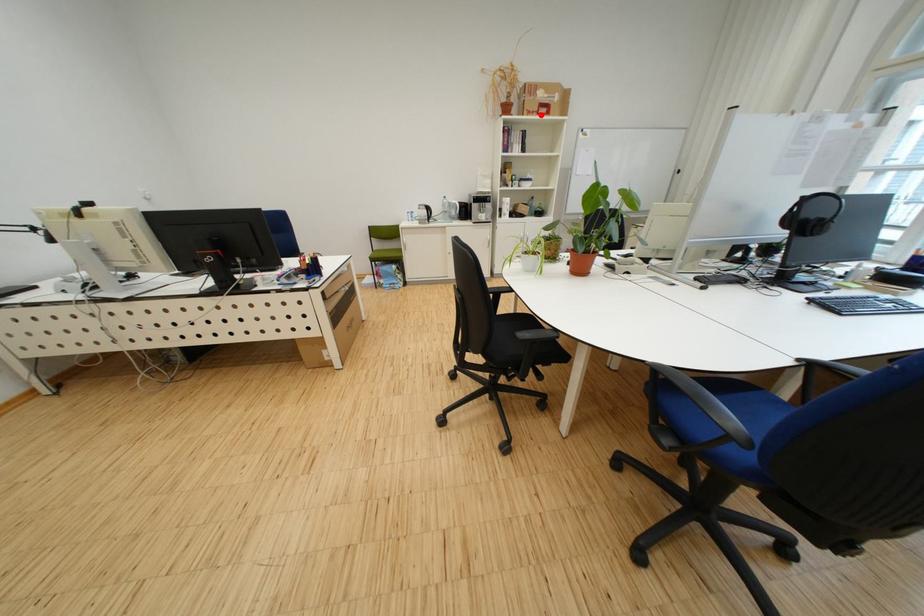
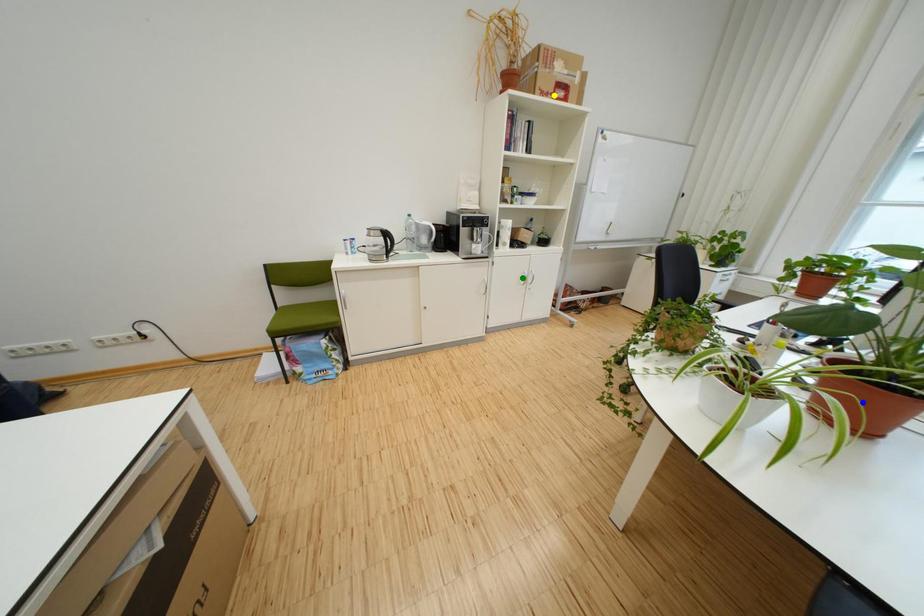
Question: I am providing you with two images of the same scene from different viewpoints. A red point is marked on the first image. You are given multiple points on the second image. Which mark in image 2 goes with the point in image 1?

Choices:
 (A) green point
 (B) blue point
 (C) yellow point

Answer: (C)